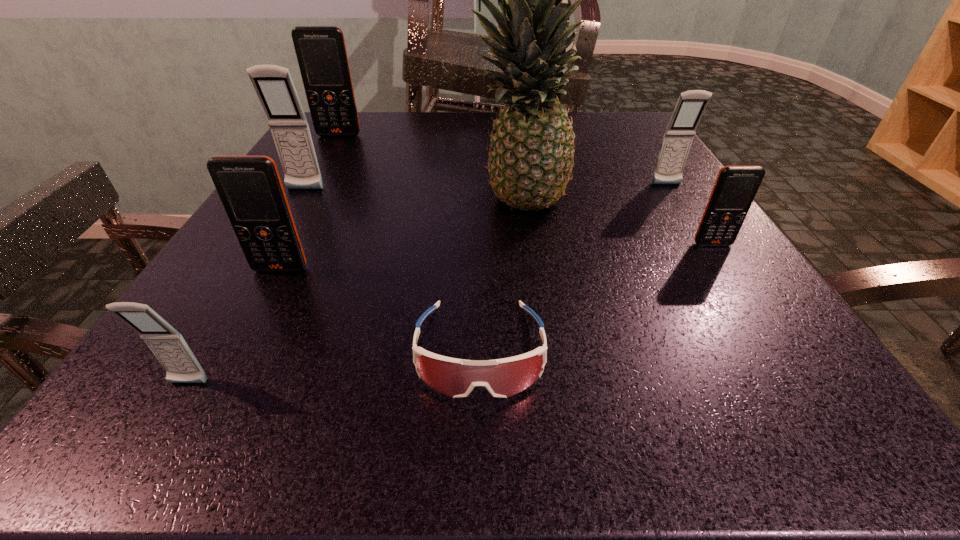
Locate an element on the screen. vacant space located on the front-facing side of the second smallest gray cellular telephone is located at coordinates (685, 214).

Identify the location of vacant space positioned 0.060m on the screen of the second nearest cellular telephone. Image resolution: width=960 pixels, height=540 pixels. (263, 302).

Image resolution: width=960 pixels, height=540 pixels. In order to click on vacant space located 0.080m on the screen of the third nearest cellular telephone in this screenshot , I will do `click(736, 281)`.

Where is `cellular telephone that is at the near edge`? This screenshot has height=540, width=960. cellular telephone that is at the near edge is located at coordinates (167, 344).

You are a GUI agent. You are given a task and a screenshot of the screen. Output one action in this format:
    pyautogui.click(x=<x>, y=<y>)
    Task: Click on the goggles present at the near edge
    
    Given the screenshot: What is the action you would take?
    pyautogui.click(x=456, y=378)

Where is `object located at the far left corner`? The width and height of the screenshot is (960, 540). object located at the far left corner is located at coordinates (321, 52).

Find the location of `object that is at the near left corner`. object that is at the near left corner is located at coordinates (167, 344).

Identify the location of blank space at the far edge. The image size is (960, 540). [x=454, y=134].

At what (x,y) coordinates should I click in order to perform the action: click on vacant space at the left edge of the desktop. Please return your answer as a coordinate pair (x, y). This screenshot has height=540, width=960. Looking at the image, I should click on (340, 198).

What are the coordinates of `free space at the right edge` in the screenshot? It's located at (643, 177).